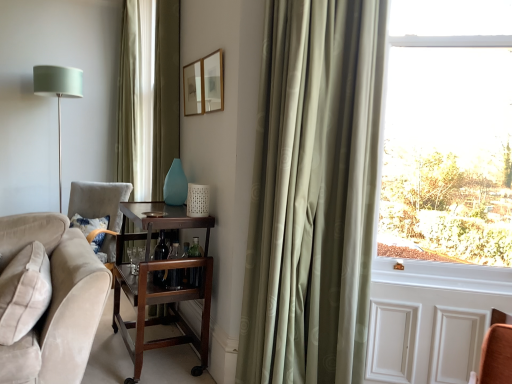
This screenshot has height=384, width=512. What do you see at coordinates (213, 82) in the screenshot?
I see `matte wooden picture frame at upper center, positioned as the first picture frame in right-to-left order` at bounding box center [213, 82].

The height and width of the screenshot is (384, 512). What are the coordinates of `matte wooden picture frame at upper center, the second picture frame positioned from the back` in the screenshot? It's located at (213, 82).

This screenshot has width=512, height=384. In order to click on satin green curtain at right in this screenshot , I will do `click(313, 193)`.

At what (x,y) coordinates should I click in order to perform the action: click on matte green shade at left. Please return your answer as a coordinate pair (x, y). The height and width of the screenshot is (384, 512). Looking at the image, I should click on (58, 95).

Describe the element at coordinates (58, 95) in the screenshot. I see `matte green shade at left` at that location.

This screenshot has width=512, height=384. What do you see at coordinates (193, 88) in the screenshot? I see `wooden picture frame at upper center, which is the 2th picture frame from front to back` at bounding box center [193, 88].

Where is `wooden picture frame at upper center, which is the first picture frame from back to front`? wooden picture frame at upper center, which is the first picture frame from back to front is located at coordinates (193, 88).

This screenshot has width=512, height=384. Find the location of `transparent glass window at right`. transparent glass window at right is located at coordinates (448, 143).

Find the location of a particular element. matte wooden picture frame at upper center, positioned as the first picture frame in right-to-left order is located at coordinates (213, 82).

How different are the orientations of matte wooden picture frame at upper center, the second picture frame positioned from the back, and mahogany wood bar cart at center in degrees?

The facing directions of matte wooden picture frame at upper center, the second picture frame positioned from the back, and mahogany wood bar cart at center are 2.39 degrees apart.

Looking at this image, is matte wooden picture frame at upper center, the second picture frame positioned from the back, thinner than mahogany wood bar cart at center?

Indeed, matte wooden picture frame at upper center, the second picture frame positioned from the back, has a lesser width compared to mahogany wood bar cart at center.

Is matte wooden picture frame at upper center, the first picture frame when ordered from front to back, positioned far away from mahogany wood bar cart at center?

They are positioned close to each other.

Is matte wooden picture frame at upper center, the first picture frame when ordered from front to back, smaller than mahogany wood bar cart at center?

Correct, matte wooden picture frame at upper center, the first picture frame when ordered from front to back, occupies less space than mahogany wood bar cart at center.

Considering the sizes of objects wooden picture frame at upper center, the 2th picture frame viewed from the right, and matte green shade at left in the image provided, who is wider, wooden picture frame at upper center, the 2th picture frame viewed from the right, or matte green shade at left?

With larger width is matte green shade at left.

From a real-world perspective, is wooden picture frame at upper center, which is the 2th picture frame from front to back, over matte green shade at left?

Yes, from a real-world perspective, wooden picture frame at upper center, which is the 2th picture frame from front to back, is above matte green shade at left.

Where is `table lamp that appears below the wooden picture frame at upper center, which is the 2th picture frame from front to back (from a real-world perspective)`? This screenshot has height=384, width=512. table lamp that appears below the wooden picture frame at upper center, which is the 2th picture frame from front to back (from a real-world perspective) is located at coordinates (58, 95).

Measure the distance between wooden picture frame at upper center, the 2th picture frame viewed from the right, and matte green shade at left.

wooden picture frame at upper center, the 2th picture frame viewed from the right, and matte green shade at left are 1.58 meters apart.

From a real-world perspective, does matte green shade at left stand above transparent glass window at right?

Actually, matte green shade at left is physically below transparent glass window at right in the real world.

Is matte green shade at left at the right side of transparent glass window at right?

In fact, matte green shade at left is to the left of transparent glass window at right.

From the image's perspective, is matte green shade at left located above or below transparent glass window at right?

matte green shade at left is situated higher than transparent glass window at right in the image.

How different are the orientations of matte green shade at left and transparent glass window at right in degrees?

There is a 53.4-degree angle between the facing directions of matte green shade at left and transparent glass window at right.

Which of these two, matte green shade at left or teal glass vase at center, is bigger?

matte green shade at left.

Considering their positions, is matte green shade at left located in front of or behind teal glass vase at center?

Clearly, matte green shade at left is behind teal glass vase at center.

Is matte green shade at left completely or partially outside of teal glass vase at center?

Yes, matte green shade at left is located beyond the bounds of teal glass vase at center.

Based on the photo, is matte wooden picture frame at upper center, the second picture frame viewed from the left, surrounded by transparent glass window at right?

That's incorrect, matte wooden picture frame at upper center, the second picture frame viewed from the left, is not inside transparent glass window at right.

Does transparent glass window at right have a lesser width compared to matte wooden picture frame at upper center, positioned as the first picture frame in right-to-left order?

Incorrect, the width of transparent glass window at right is not less than that of matte wooden picture frame at upper center, positioned as the first picture frame in right-to-left order.

Does point (393, 174) come closer to viewer compared to point (214, 100)?

Yes, it is in front of point (214, 100).

Where is `teal above the satin green curtain at right (from a real-world perspective)`? Image resolution: width=512 pixels, height=384 pixels. teal above the satin green curtain at right (from a real-world perspective) is located at coordinates (175, 185).

Considering the relative sizes of satin green curtain at right and teal glass vase at center in the image provided, is satin green curtain at right shorter than teal glass vase at center?

No.

Which is behind, satin green curtain at right or teal glass vase at center?

Positioned behind is teal glass vase at center.

Is wooden picture frame at upper center, the 1th picture frame from the left, next to satin green curtain at right?

No, wooden picture frame at upper center, the 1th picture frame from the left, is not in contact with satin green curtain at right.

Does wooden picture frame at upper center, the 2th picture frame viewed from the right, have a larger size compared to satin green curtain at right?

Incorrect, wooden picture frame at upper center, the 2th picture frame viewed from the right, is not larger than satin green curtain at right.

Considering the sizes of objects wooden picture frame at upper center, which is the 2th picture frame from front to back, and satin green curtain at right in the image provided, who is wider, wooden picture frame at upper center, which is the 2th picture frame from front to back, or satin green curtain at right?

With larger width is satin green curtain at right.

Measure the distance from wooden picture frame at upper center, the 2th picture frame viewed from the right, to satin green curtain at right.

wooden picture frame at upper center, the 2th picture frame viewed from the right, is 3.29 feet from satin green curtain at right.

Locate an element on the screen. the 1st picture frame positioned above the mahogany wood bar cart at center (from the image's perspective) is located at coordinates (213, 82).

Locate an element on the screen. table lamp located below the wooden picture frame at upper center, the 1th picture frame from the left (from the image's perspective) is located at coordinates (58, 95).

When comparing their distances from transparent glass window at right, does mahogany wood bar cart at center or wooden picture frame at upper center, the 1th picture frame from the left, seem closer?

mahogany wood bar cart at center lies closer to transparent glass window at right than the other object.

From the image, which object appears to be nearer to velvet blue pillow at lower left, teal glass vase at center or mahogany wood bar cart at center?

mahogany wood bar cart at center.

Which object lies nearer to the anchor point mahogany wood bar cart at center, matte wooden picture frame at upper center, positioned as the first picture frame in right-to-left order, or matte green shade at left?

matte wooden picture frame at upper center, positioned as the first picture frame in right-to-left order, lies closer to mahogany wood bar cart at center than the other object.

Which object lies nearer to the anchor point velvet blue pillow at lower left, transparent glass window at right or matte green shade at left?

Based on the image, matte green shade at left appears to be nearer to velvet blue pillow at lower left.

Which object lies nearer to the anchor point matte wooden picture frame at upper center, positioned as the first picture frame in right-to-left order, wooden picture frame at upper center, which is the 2th picture frame from front to back, or satin green curtain at right?

Based on the image, wooden picture frame at upper center, which is the 2th picture frame from front to back, appears to be nearer to matte wooden picture frame at upper center, positioned as the first picture frame in right-to-left order.

Based on the photo, looking at the image, which one is located further to matte green shade at left, wooden picture frame at upper center, which is the first picture frame from back to front, or velvet blue pillow at lower left?

Among the two, wooden picture frame at upper center, which is the first picture frame from back to front, is located further to matte green shade at left.

Considering their positions, is velvet blue pillow at lower left positioned closer to matte green shade at left than wooden picture frame at upper center, which is the first picture frame from back to front?

velvet blue pillow at lower left is positioned closer to the anchor matte green shade at left.

From the image, which object appears to be farther from wooden picture frame at upper center, which is the first picture frame from back to front, matte green shade at left or mahogany wood bar cart at center?

Among the two, matte green shade at left is located further to wooden picture frame at upper center, which is the first picture frame from back to front.

Where is `curtain located between velvet blue pillow at lower left and transparent glass window at right in the left-right direction`? curtain located between velvet blue pillow at lower left and transparent glass window at right in the left-right direction is located at coordinates (313, 193).

You are a GUI agent. You are given a task and a screenshot of the screen. Output one action in this format:
    pyautogui.click(x=<x>, y=<y>)
    Task: Click on the curtain situated between matte wooden picture frame at upper center, the first picture frame when ordered from front to back, and transparent glass window at right from left to right
    The image size is (512, 384).
    Given the screenshot: What is the action you would take?
    pyautogui.click(x=313, y=193)

At what (x,y) coordinates should I click in order to perform the action: click on table between velvet blue pillow at lower left and transparent glass window at right from left to right. Please return your answer as a coordinate pair (x, y). The image size is (512, 384). Looking at the image, I should click on (158, 285).

Find the location of `pillow between mahogany wood bar cart at center and matte green shade at left in the front-back direction`. pillow between mahogany wood bar cart at center and matte green shade at left in the front-back direction is located at coordinates (89, 223).